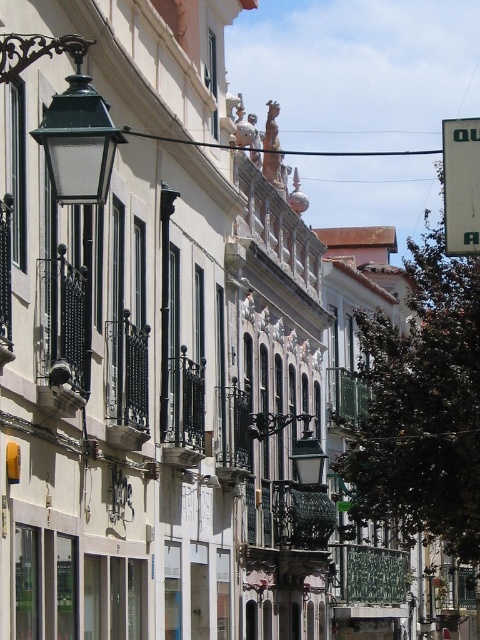
Question: Which point is closer to the camera?

Choices:
 (A) (450, 221)
 (B) (39, 38)

Answer: (B)

Question: Can you confirm if green matte streetlamp at upper left is positioned to the left of white plastic sign at upper right?

Choices:
 (A) yes
 (B) no

Answer: (A)

Question: Which point is farther to the camera?

Choices:
 (A) white plastic sign at upper right
 (B) green matte streetlamp at upper left

Answer: (A)

Question: Considering the relative positions of green matte streetlamp at upper left and white plastic sign at upper right in the image provided, where is green matte streetlamp at upper left located with respect to white plastic sign at upper right?

Choices:
 (A) below
 (B) above

Answer: (A)

Question: Observing the image, what is the correct spatial positioning of green matte streetlamp at upper left in reference to white plastic sign at upper right?

Choices:
 (A) below
 (B) above

Answer: (A)